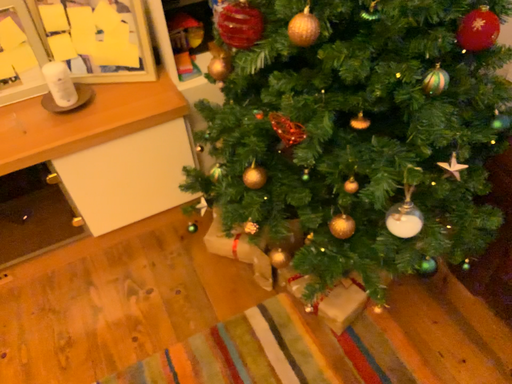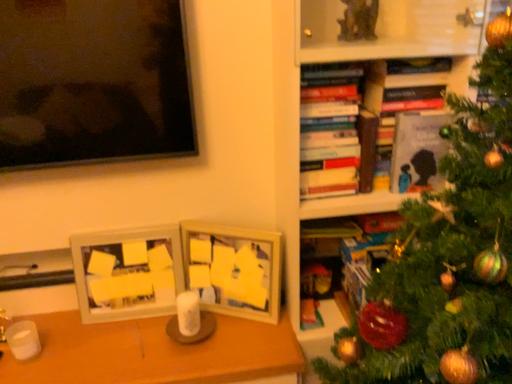
Question: Which way did the camera rotate in the video?

Choices:
 (A) rotated left
 (B) rotated right

Answer: (A)